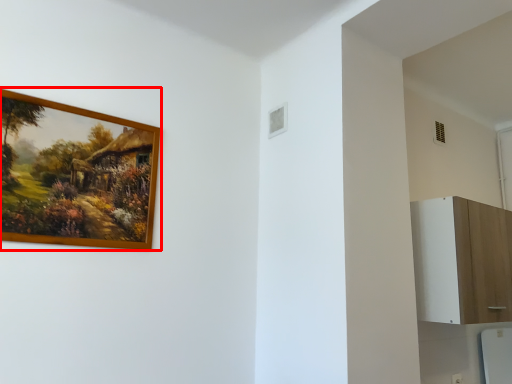
Question: Where is picture frame (annotated by the red box) located in relation to dresser in the image?

Choices:
 (A) left
 (B) right

Answer: (A)